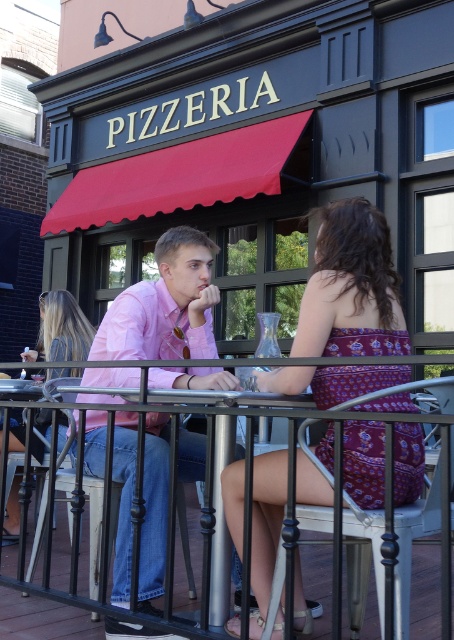
You are a delivery person standing in front of the Pizzeria and need to hand over a pizza to the person with blonde hair at center. The black metal railing at center is in your way. Can you reach them without moving the railing?

The blonde hair at center is smaller than the black metal railing at center, so the railing is larger and likely obstructs your path. You may need to move the railing or find another way around to reach the person.

You are standing at the entrance of the pizzeria and want to sit down at the table. Which object should you walk around to reach the table, the pink cotton shirt at center or the black metal railing at center?

The pink cotton shirt at center is positioned on the left side of the black metal railing at center, so you should walk around the black metal railing at center to reach the table.

You are a photographer standing behind the metal railing outside the pizzeria. You want to take a photo of the two people seated at the table. Which object, the printed fabric dress at center or the blonde hair at center, will appear bigger in your photo?

The printed fabric dress at center will appear bigger in the photo because it has a larger size compared to the blonde hair at center.